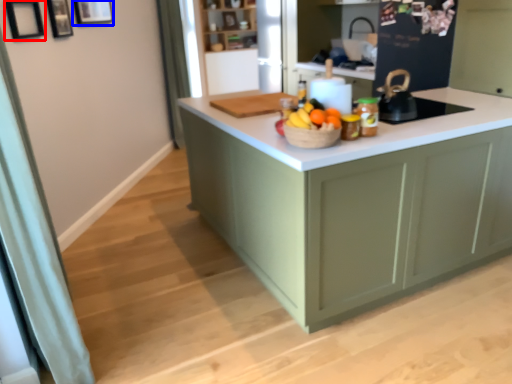
Question: Which of the following is the closest to the observer, picture frame (highlighted by a red box) or picture frame (highlighted by a blue box)?

Choices:
 (A) picture frame
 (B) picture frame

Answer: (A)